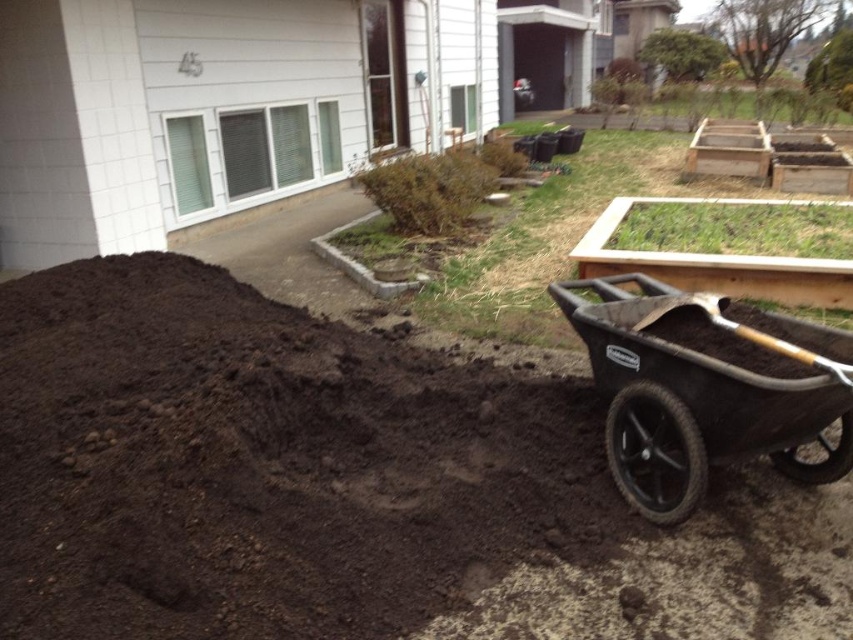
Question: Does dark brown soil at center appear under wooden shovel at lower right?

Choices:
 (A) no
 (B) yes

Answer: (B)

Question: Is black rubber wheelbarrow at lower right to the right of wooden shovel at lower right from the viewer's perspective?

Choices:
 (A) yes
 (B) no

Answer: (A)

Question: Which point is farther from the camera taking this photo?

Choices:
 (A) (592, 355)
 (B) (531, 380)
 (C) (755, 333)

Answer: (B)

Question: Is dark brown soil at center thinner than wooden shovel at lower right?

Choices:
 (A) no
 (B) yes

Answer: (A)

Question: Which of the following is the closest to the observer?

Choices:
 (A) wooden shovel at lower right
 (B) dark brown soil at center
 (C) black rubber wheelbarrow at lower right

Answer: (B)

Question: Which point is farther from the camera taking this photo?

Choices:
 (A) (828, 365)
 (B) (646, 323)
 (C) (146, 570)

Answer: (B)